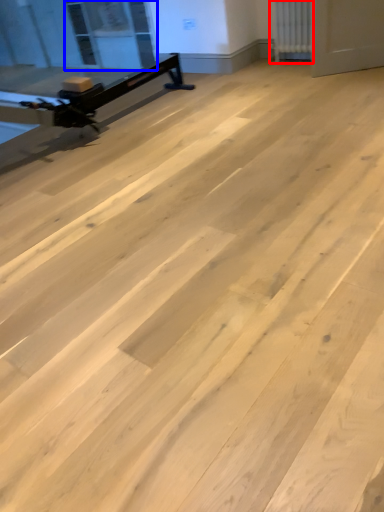
Question: Which point is closer to the camera, radiator (highlighted by a red box) or window screen (highlighted by a blue box)?

Choices:
 (A) radiator
 (B) window screen

Answer: (A)